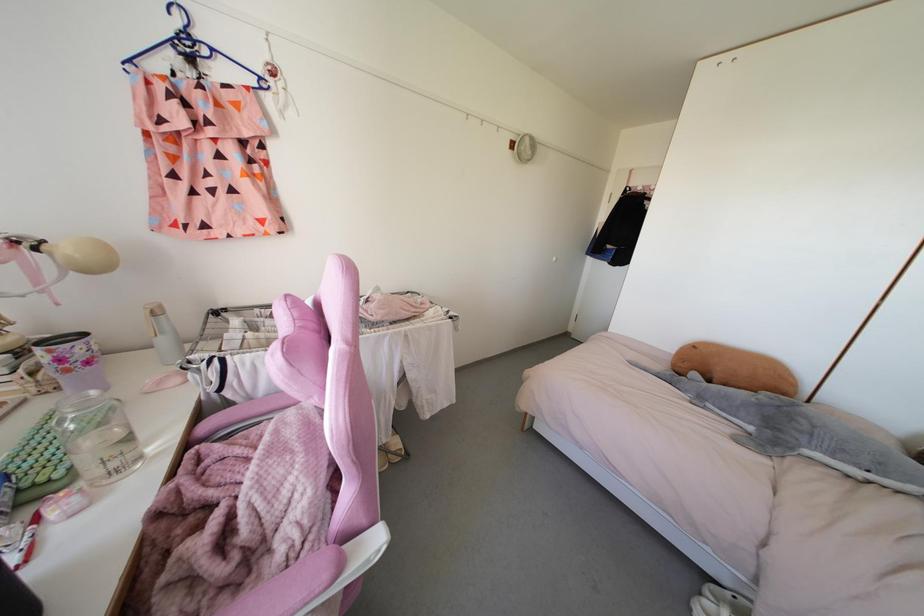
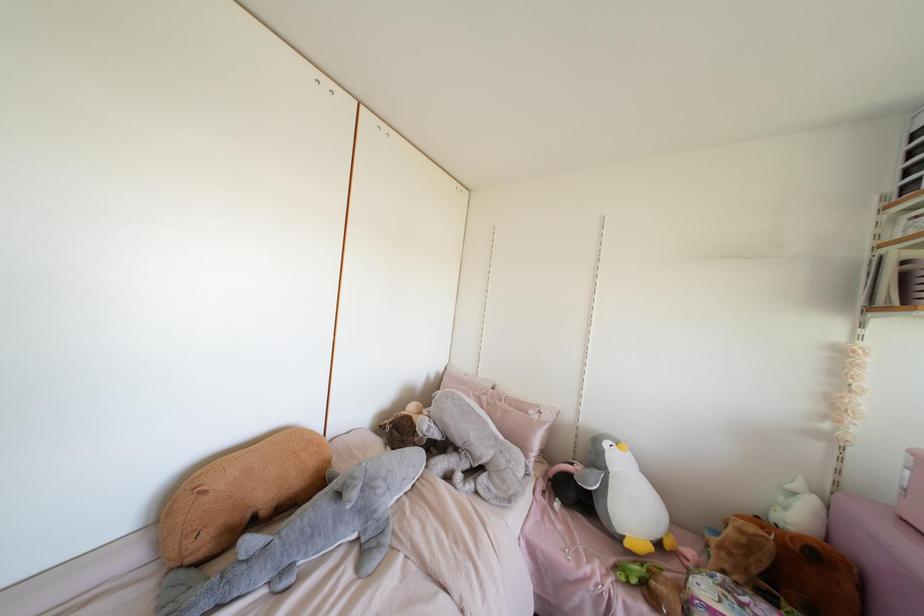
The point at (843,450) is marked in the first image. Where is the corresponding point in the second image?

(403, 479)